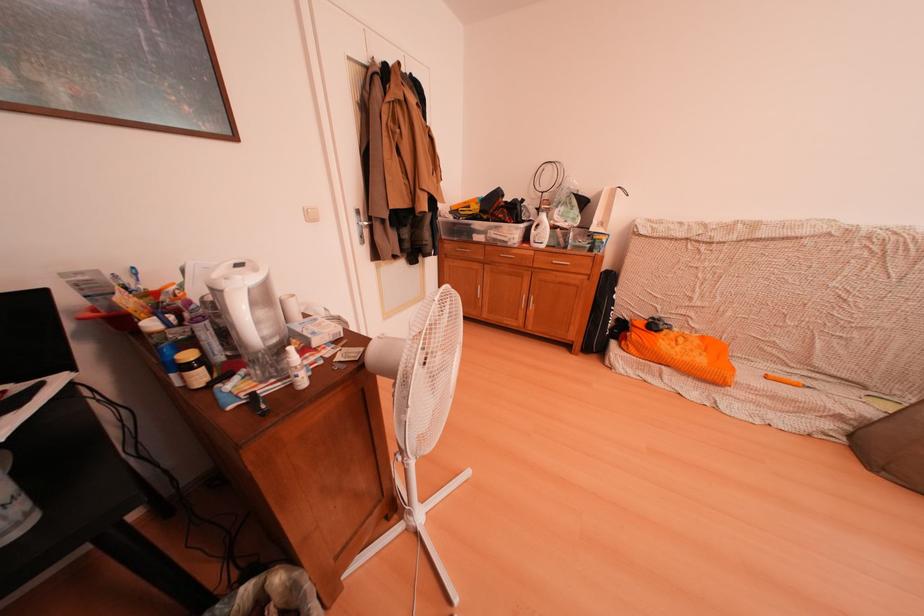
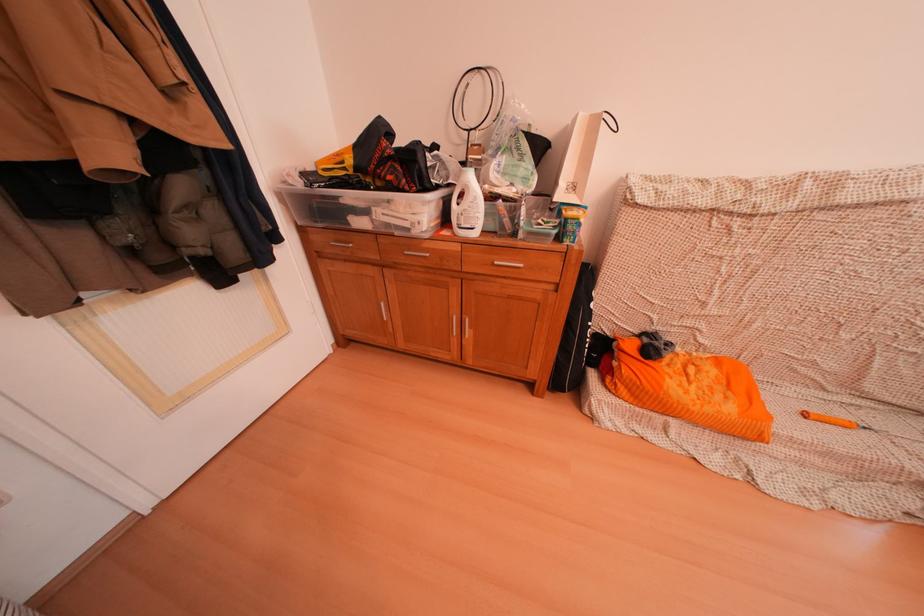
Locate, in the second image, the point that corresponds to [541,225] in the first image.

(462, 190)